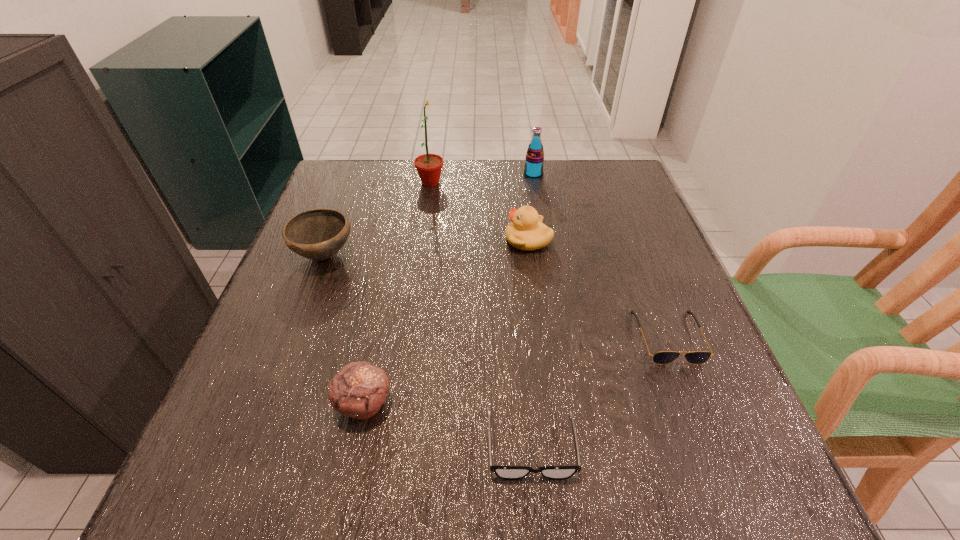
Image resolution: width=960 pixels, height=540 pixels. In order to click on free space in the image that satisfies the following two spatial constraints: 1. on the beak of the duckling; 2. on the front side of the muffin in this screenshot , I will do `click(548, 404)`.

At what (x,y) coordinates should I click in order to perform the action: click on vacant space that satisfies the following two spatial constraints: 1. on the back side of the muffin; 2. on the left side of the sixth shortest object. Please return your answer as a coordinate pair (x, y). The width and height of the screenshot is (960, 540). Looking at the image, I should click on (412, 174).